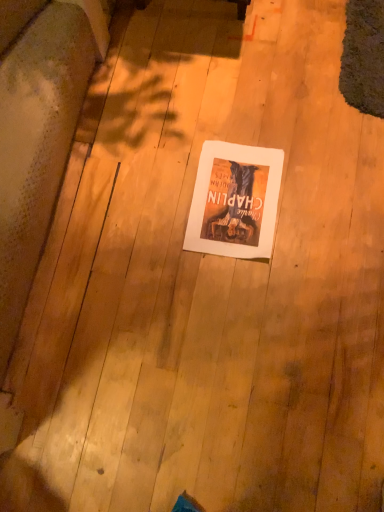
Where is `vacant region above white paper poster at center (from a real-world perspective)`? vacant region above white paper poster at center (from a real-world perspective) is located at coordinates (234, 206).